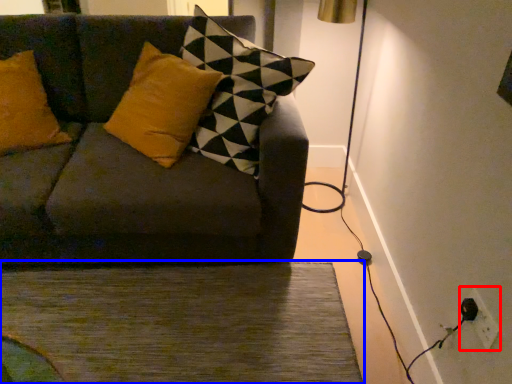
Question: Which of the following is the farthest to the observer, electric outlet (highlighted by a red box) or doormat (highlighted by a blue box)?

Choices:
 (A) electric outlet
 (B) doormat

Answer: (B)